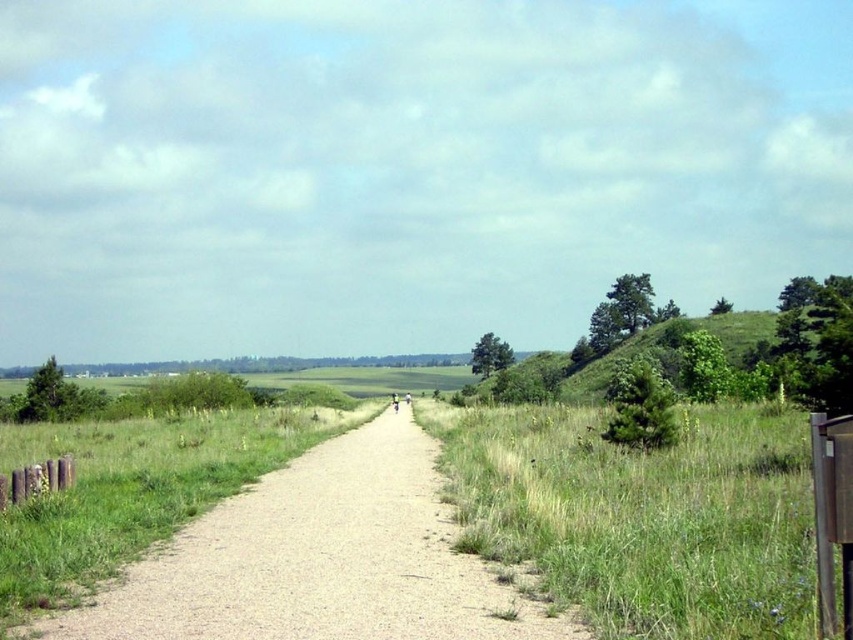
Question: Does green grassy at right have a lesser width compared to green grassy hill at right?

Choices:
 (A) no
 (B) yes

Answer: (B)

Question: Which object is closer to the camera taking this photo?

Choices:
 (A) green grassy at right
 (B) green grassy hill at right

Answer: (A)

Question: Does gravel path at center appear over green grassy hill at right?

Choices:
 (A) yes
 (B) no

Answer: (B)

Question: Which point is farther to the camera?

Choices:
 (A) (668, 324)
 (B) (486, 518)
 (C) (321, 550)

Answer: (A)

Question: Which object is farther from the camera taking this photo?

Choices:
 (A) green grassy at right
 (B) gravel path at center

Answer: (B)

Question: Is green grassy at right further to camera compared to gravel path at center?

Choices:
 (A) no
 (B) yes

Answer: (A)